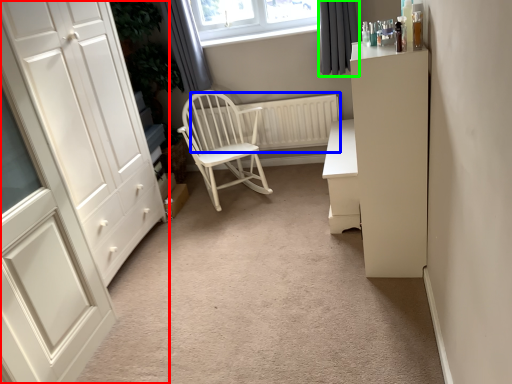
Question: Considering the real-world distances, which object is farthest from cupboard (highlighted by a red box)? radiator (highlighted by a blue box) or curtain (highlighted by a green box)?

Choices:
 (A) radiator
 (B) curtain

Answer: (B)